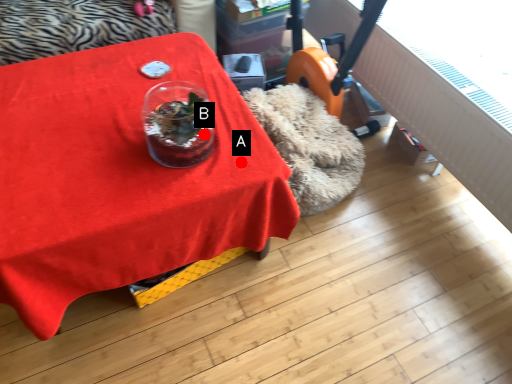
Question: Two points are circled on the image, labeled by A and B beside each circle. Which point appears farthest from the camera in this image?

Choices:
 (A) A is further
 (B) B is further

Answer: (A)